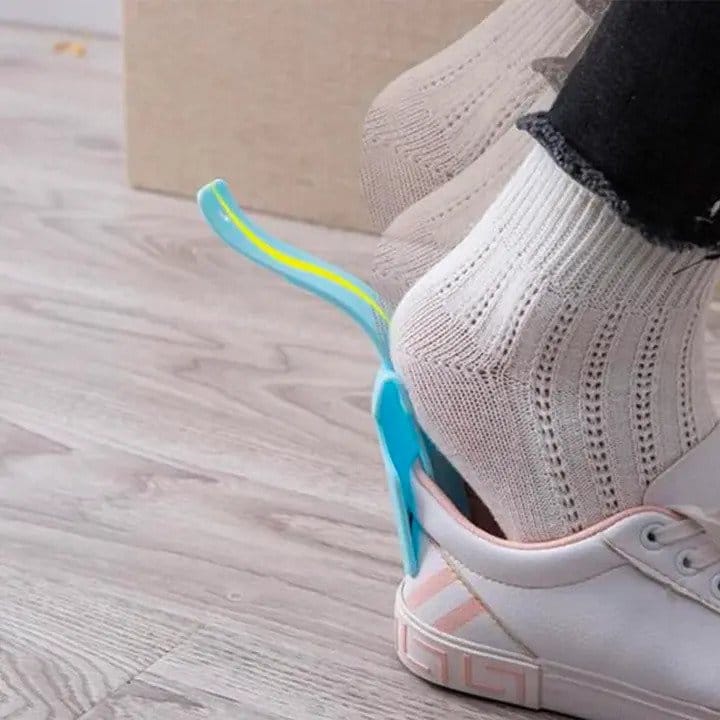
Where is `wood floor`? The height and width of the screenshot is (720, 720). wood floor is located at coordinates (202, 474).